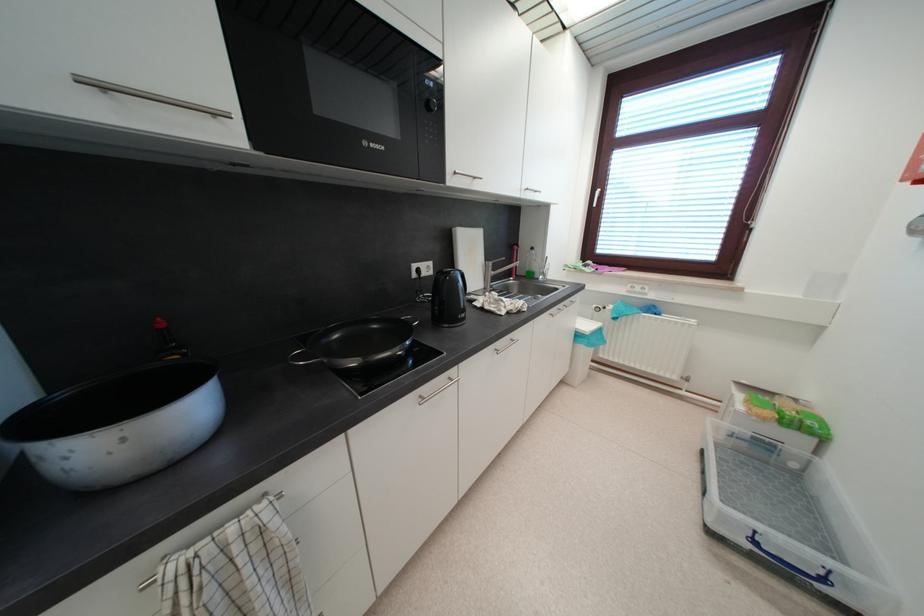
Identify the location of large silver pot. The width and height of the screenshot is (924, 616). (119, 424).